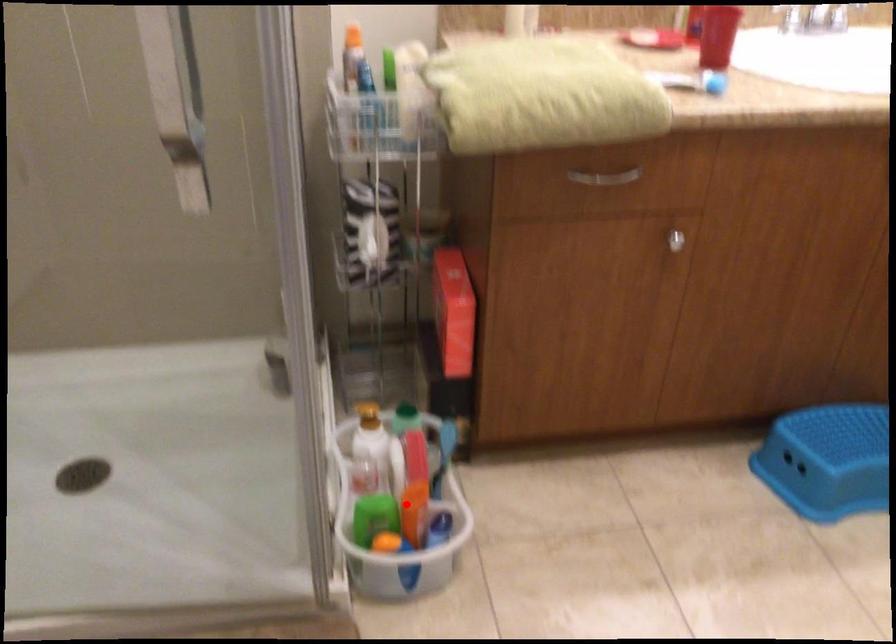
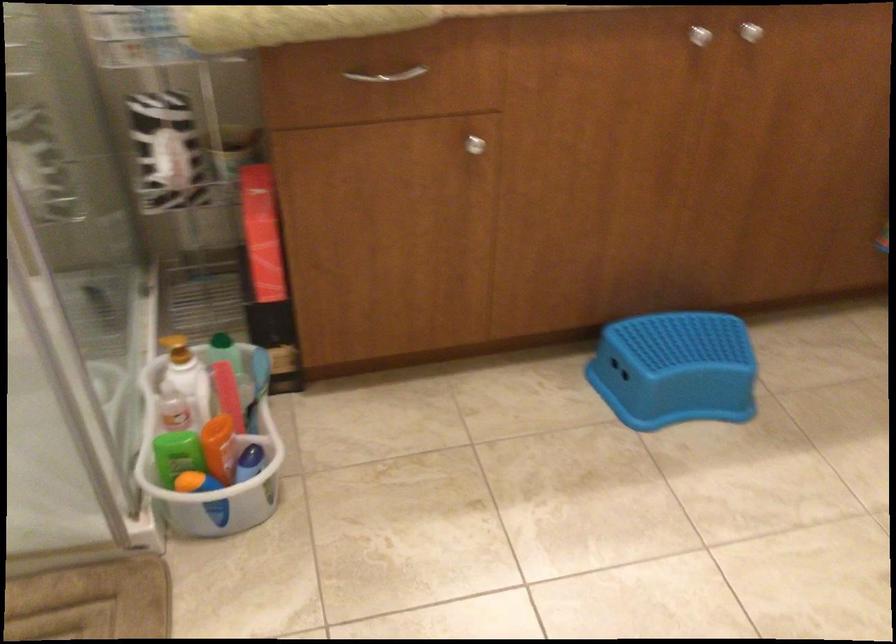
Where in the second image is the point corresponding to the highlighted location from the first image?

(208, 439)